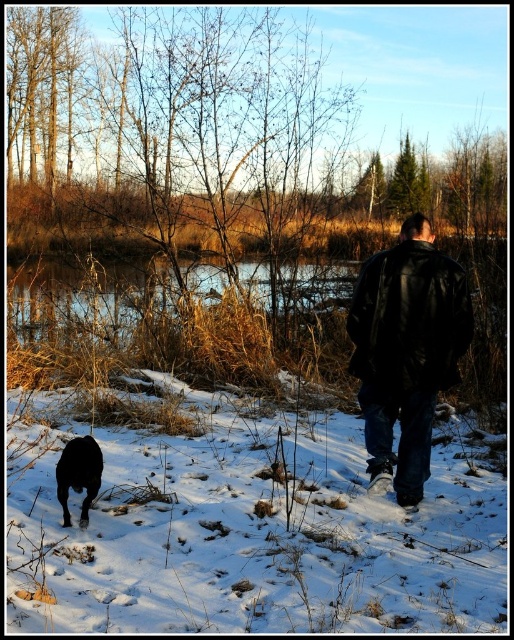
You are planning to build a snowman using the white fluffy snow at lower center. However, you also want to keep your black leather jacket at center dry. Which object should you handle first and why?

You should handle the white fluffy snow at lower center first because it is bigger than the black leather jacket at center, so it requires more material and time. By starting with the larger snowball, you can ensure you have enough snow before getting the jacket wet.